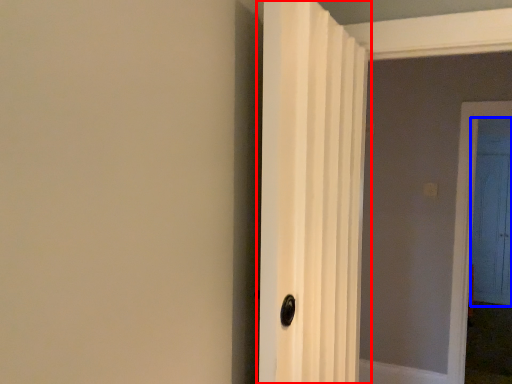
Question: Which object is closer to the camera taking this photo, door (highlighted by a red box) or door (highlighted by a blue box)?

Choices:
 (A) door
 (B) door

Answer: (A)